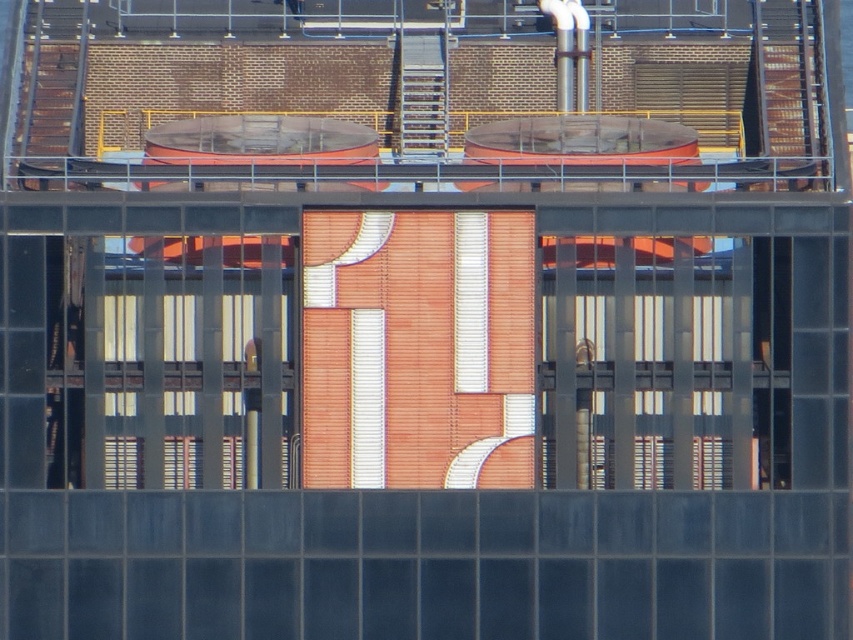
Question: Is transparent glass window at center bigger than translucent glass window at center?

Choices:
 (A) yes
 (B) no

Answer: (B)

Question: Does transparent glass window at center have a lesser width compared to translucent glass window at center?

Choices:
 (A) yes
 (B) no

Answer: (A)

Question: Can you confirm if transparent glass window at center is smaller than translucent glass window at center?

Choices:
 (A) no
 (B) yes

Answer: (B)

Question: Which object appears farthest from the camera in this image?

Choices:
 (A) translucent glass window at center
 (B) transparent glass window at center

Answer: (B)

Question: Which of the following is the farthest from the observer?

Choices:
 (A) (747, 442)
 (B) (111, 285)

Answer: (B)